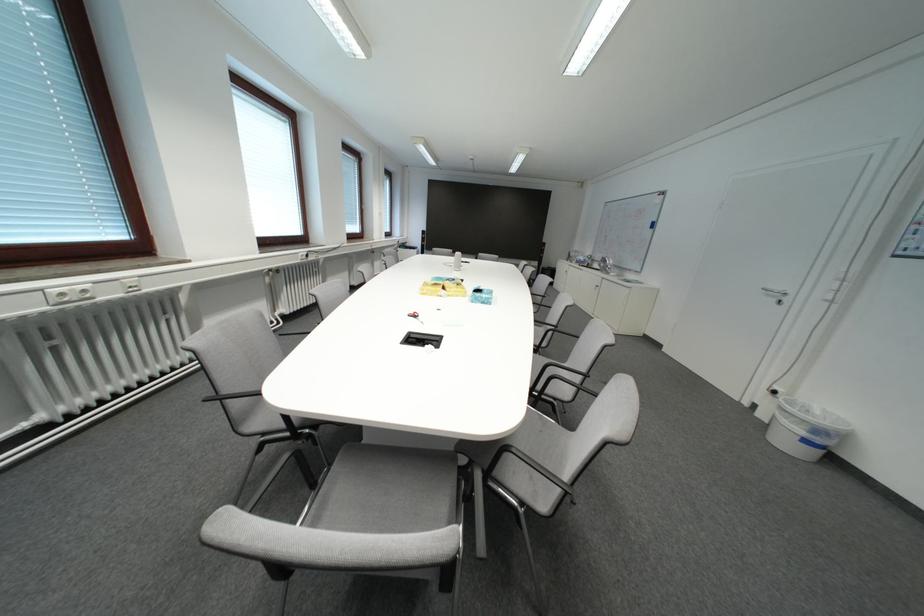
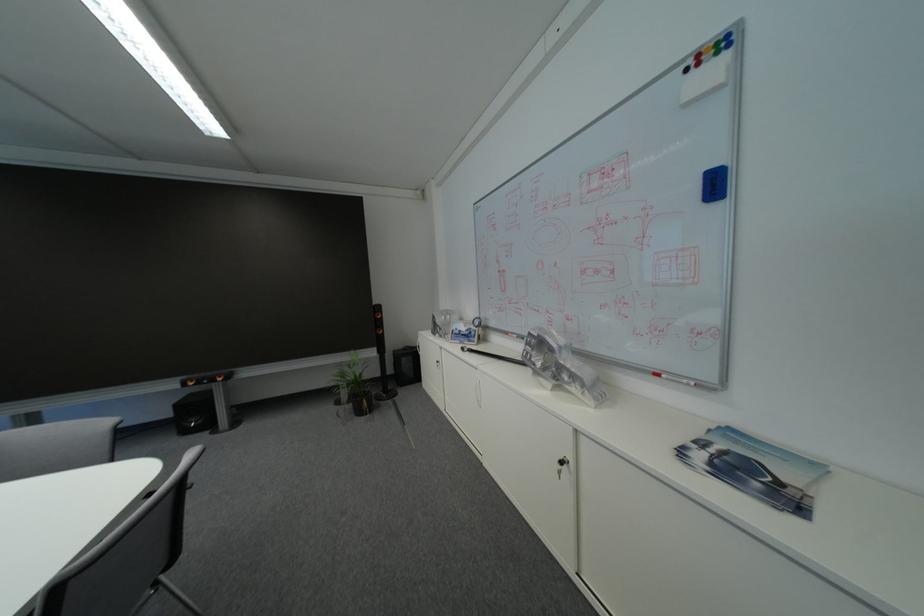
The point at (663, 228) is marked in the first image. Where is the corresponding point in the second image?

(726, 188)